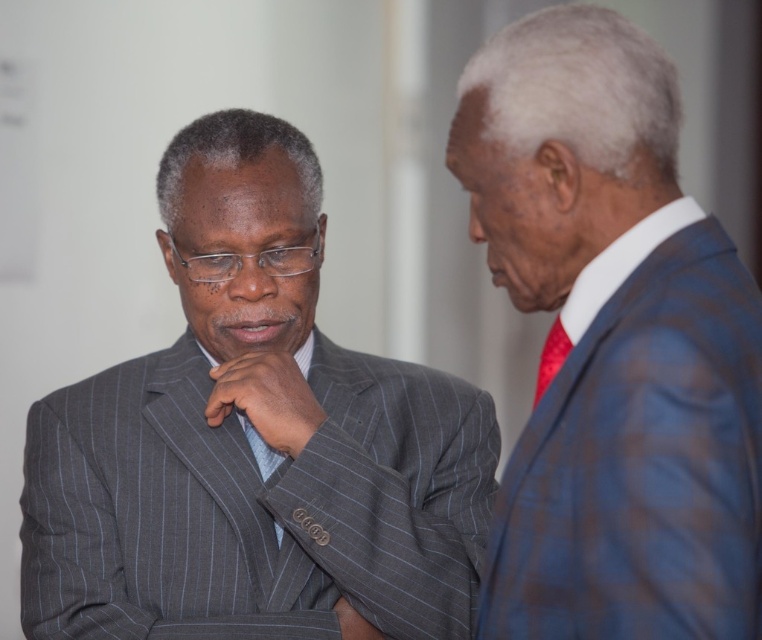
You are an interior designer assessing the spatial arrangement of the two men in the image. Given that the blue plaid suit at right and the red satin tie at right are both on the same side of the room, which object occupies more horizontal space?

The blue plaid suit at right has a greater width than the red satin tie at right, so the blue plaid suit at right occupies more horizontal space.

Based on the photo, you are a photographer setting up a shoot in the scene. You need to place a spotlight so that it illuminates both the gray pinstripe suit at center and the red satin tie at right without casting shadows on the background wall. Given their positions, where should you place the spotlight relative to them?

The gray pinstripe suit at center is positioned under the red satin tie at right. To avoid casting shadows on the background wall, the spotlight should be placed above and between the two subjects, ensuring light falls evenly on both without creating shadows behind them.

You are standing in the room where the two men are talking. You want to hand a document to the person who is speaking. Which one should you approach, the blue plaid suit at right or the red satin tie at right?

You should approach the blue plaid suit at right because the blue plaid suit at right is closer to the viewer than the red satin tie at right, so they are the one speaking.